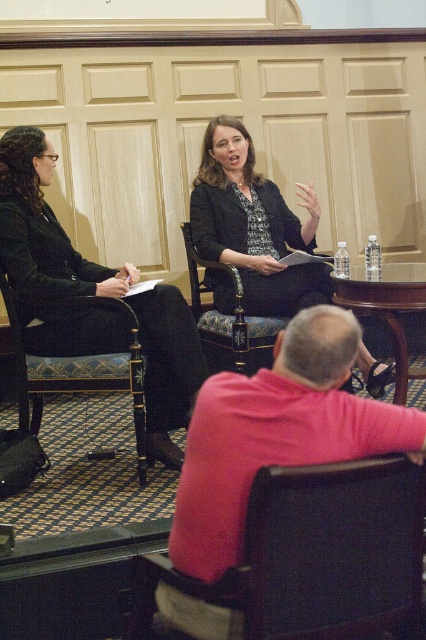
From the picture: Who is positioned more to the left, clear glass table at center or carved wood chair at center?

carved wood chair at center is more to the left.

Looking at this image, is clear glass table at center below carved wood chair at center?

Yes.

Locate an element on the screen. This screenshot has width=426, height=640. clear glass table at center is located at coordinates (386, 307).

Can you confirm if matte black blazer at center is taller than carved wood chair at center?

Indeed, matte black blazer at center has a greater height compared to carved wood chair at center.

Who is higher up, matte black blazer at center or carved wood chair at center?

Positioned higher is matte black blazer at center.

Image resolution: width=426 pixels, height=640 pixels. I want to click on matte black blazer at center, so click(253, 225).

I want to click on matte black blazer at center, so click(253, 225).

Which is in front, point (308, 428) or point (279, 312)?

Point (308, 428) is more forward.

Which is more to the right, pink fabric shirt at lower right or matte black blazer at center?

matte black blazer at center is more to the right.

Find the location of a particular element. pink fabric shirt at lower right is located at coordinates (276, 433).